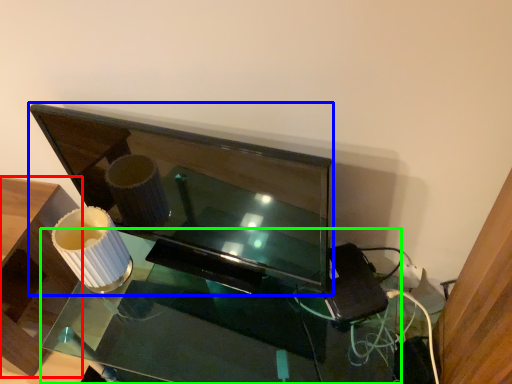
Question: Which is farther away from furniture (highlighted by a red box)? television (highlighted by a blue box) or table (highlighted by a green box)?

Choices:
 (A) television
 (B) table

Answer: (A)